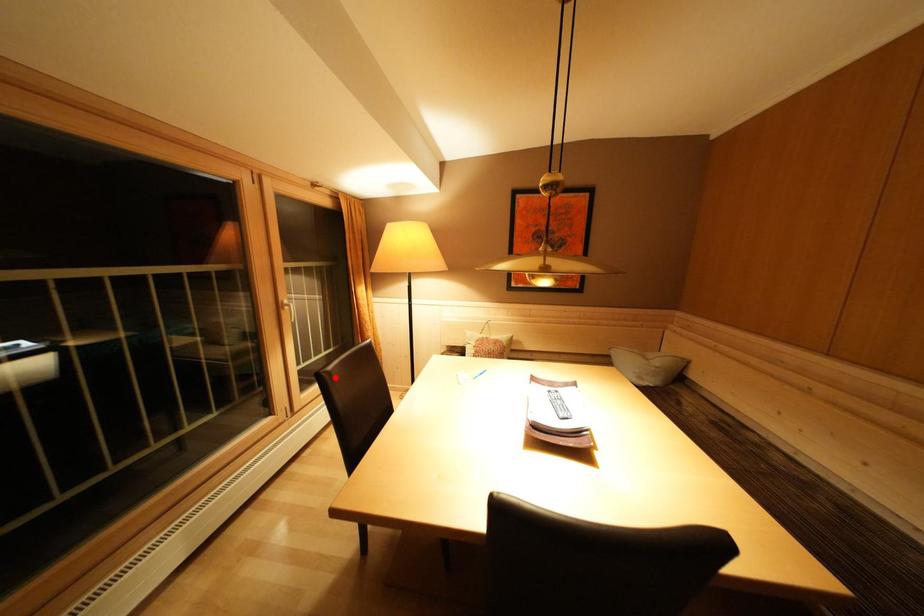
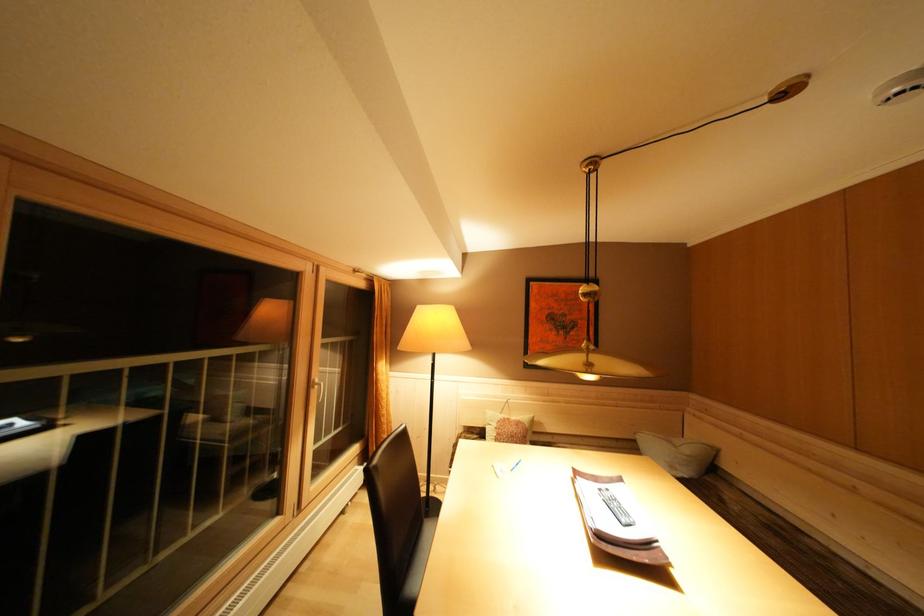
In the second image, find the point that corresponds to the highlighted location in the first image.

(383, 472)